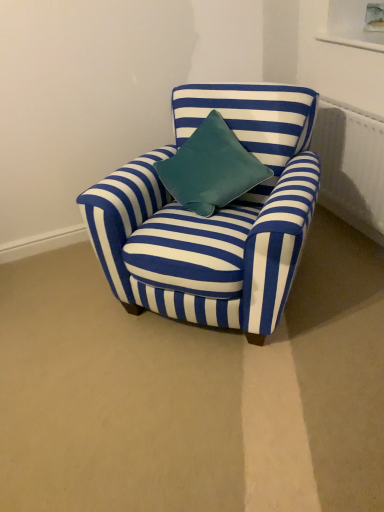
Question: Is white textured radiator at upper right shorter than blue striped fabric chair at center?

Choices:
 (A) yes
 (B) no

Answer: (A)

Question: Is white textured radiator at upper right aimed at blue striped fabric chair at center?

Choices:
 (A) yes
 (B) no

Answer: (A)

Question: Considering the relative sizes of white textured radiator at upper right and blue striped fabric chair at center in the image provided, is white textured radiator at upper right bigger than blue striped fabric chair at center?

Choices:
 (A) no
 (B) yes

Answer: (A)

Question: Is white textured radiator at upper right looking in the opposite direction of blue striped fabric chair at center?

Choices:
 (A) yes
 (B) no

Answer: (B)

Question: From a real-world perspective, does white textured radiator at upper right stand above blue striped fabric chair at center?

Choices:
 (A) no
 (B) yes

Answer: (A)

Question: Is white textured radiator at upper right located outside blue striped fabric chair at center?

Choices:
 (A) yes
 (B) no

Answer: (A)

Question: Is blue striped fabric chair at center not close to white textured radiator at upper right?

Choices:
 (A) yes
 (B) no

Answer: (B)

Question: From the image's perspective, is blue striped fabric chair at center on white textured radiator at upper right?

Choices:
 (A) yes
 (B) no

Answer: (B)

Question: Is blue striped fabric chair at center oriented away from white textured radiator at upper right?

Choices:
 (A) yes
 (B) no

Answer: (A)

Question: From the image's perspective, is blue striped fabric chair at center under white textured radiator at upper right?

Choices:
 (A) yes
 (B) no

Answer: (A)

Question: Could white textured radiator at upper right be considered to be inside blue striped fabric chair at center?

Choices:
 (A) yes
 (B) no

Answer: (B)

Question: Is blue striped fabric chair at center in front of white textured radiator at upper right?

Choices:
 (A) no
 (B) yes

Answer: (B)

Question: Is point (336, 211) closer or farther from the camera than point (264, 263)?

Choices:
 (A) closer
 (B) farther

Answer: (B)